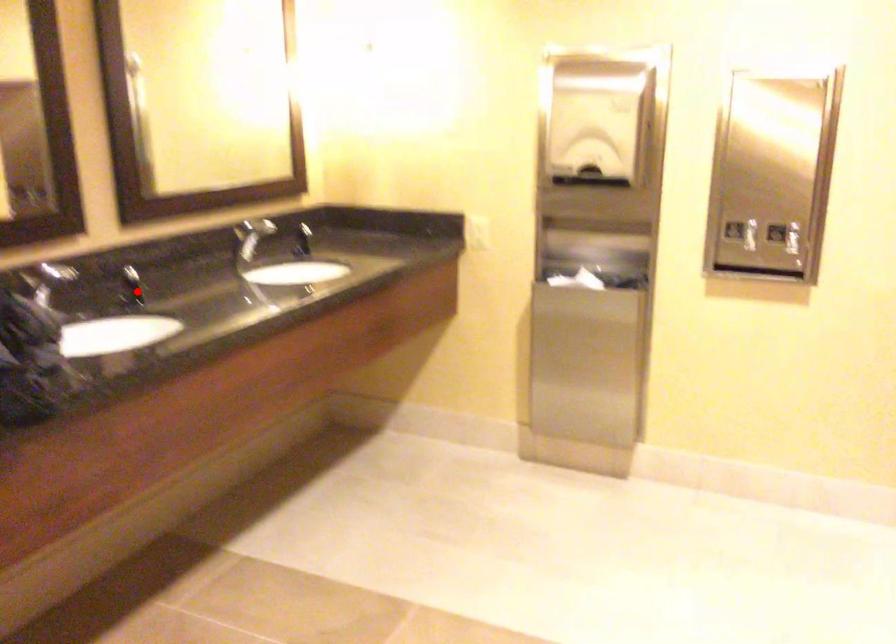
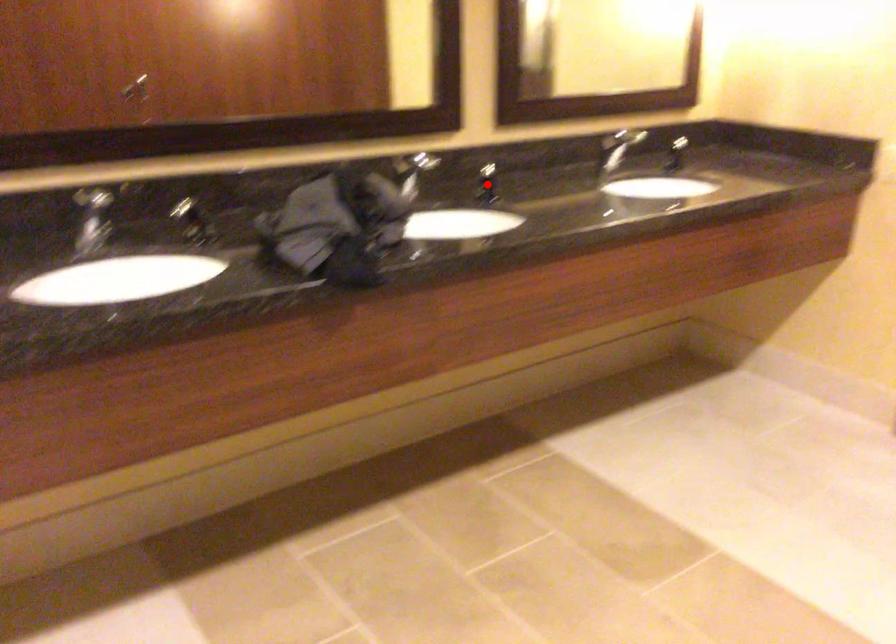
I am providing you with two images of the same scene from different viewpoints. A red point is marked on the first image and another point is marked on the second image. Does the point marked in image1 correspond to the same location as the one in image2?

Yes